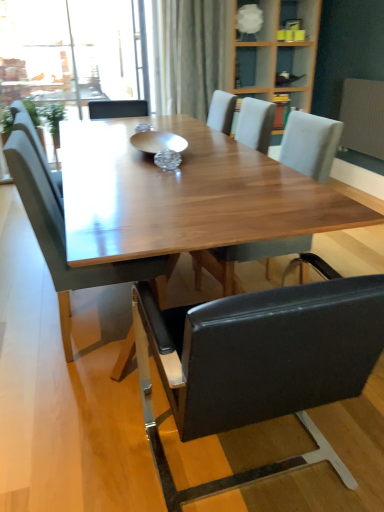
Find the location of `free point below leather-like black chair at center, the second chair in the left-to-right sequence (from a real-world perspective)`. free point below leather-like black chair at center, the second chair in the left-to-right sequence (from a real-world perspective) is located at coordinates (244, 462).